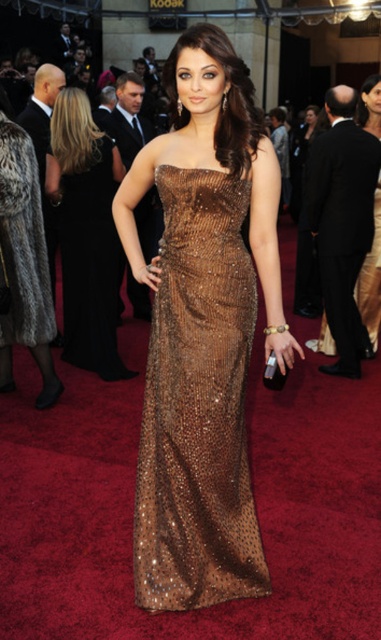
You are a photographer at the event and need to capture a full body shot of both the shiny bronze gown at center and the shiny bronze dress at center. Which one appears narrower in the photo?

The shiny bronze gown at center appears narrower compared to the shiny bronze dress at center in the photo.

You are a fashion journalist attending the event and need to describe the central figure. Which item of clothing is shorter in height between the shiny bronze gown at center and the shiny bronze dress at center?

The shiny bronze gown at center is shorter in height compared to the shiny bronze dress at center.